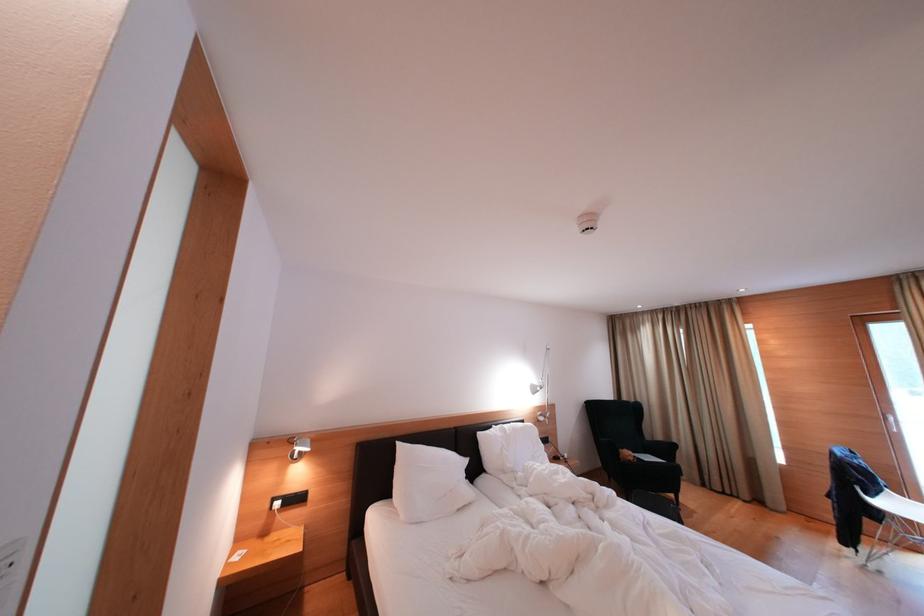
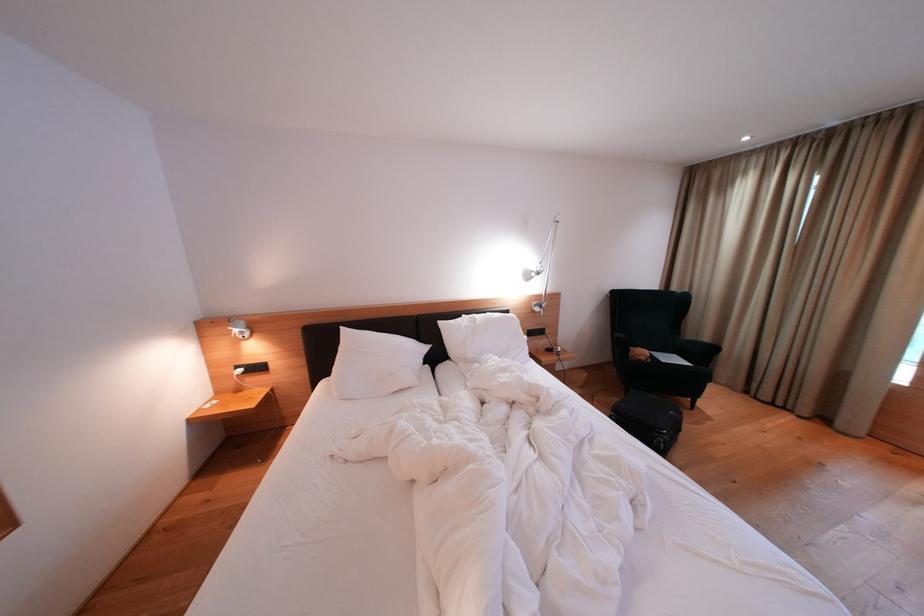
In the second image, find the point that corresponds to [406,448] in the first image.

(349, 333)